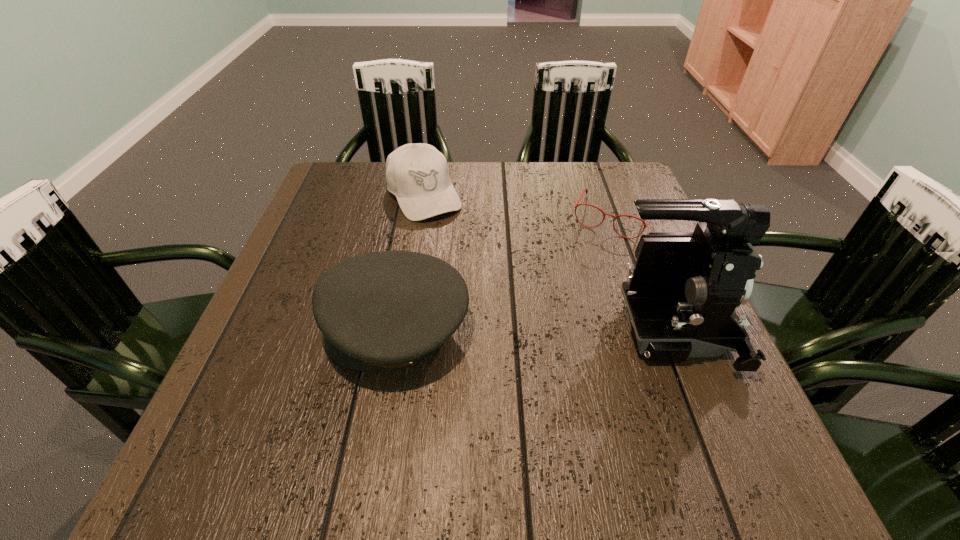
This screenshot has height=540, width=960. Identify the location of beret. (381, 310).

Locate an element on the screen. camcorder is located at coordinates (681, 298).

Locate an element on the screen. Image resolution: width=960 pixels, height=540 pixels. spectacles is located at coordinates (645, 225).

Image resolution: width=960 pixels, height=540 pixels. I want to click on baseball cap, so (x=417, y=174).

I want to click on vacant space located on the front-facing side of the beret, so click(x=283, y=330).

The height and width of the screenshot is (540, 960). In order to click on free space located 0.070m on the front-facing side of the beret in this screenshot , I will do `click(288, 330)`.

At what (x,y) coordinates should I click in order to perform the action: click on vacant space located on the face of the shortest object. Please return your answer as a coordinate pair (x, y). The height and width of the screenshot is (540, 960). Looking at the image, I should click on (576, 293).

Where is `vacant space located on the face of the shortest object`? The image size is (960, 540). vacant space located on the face of the shortest object is located at coordinates (590, 262).

Image resolution: width=960 pixels, height=540 pixels. I want to click on vacant space located 0.210m on the face of the shortest object, so click(x=575, y=296).

The width and height of the screenshot is (960, 540). What are the coordinates of `free space located 0.240m on the front-facing side of the baseball cap` in the screenshot? It's located at (475, 281).